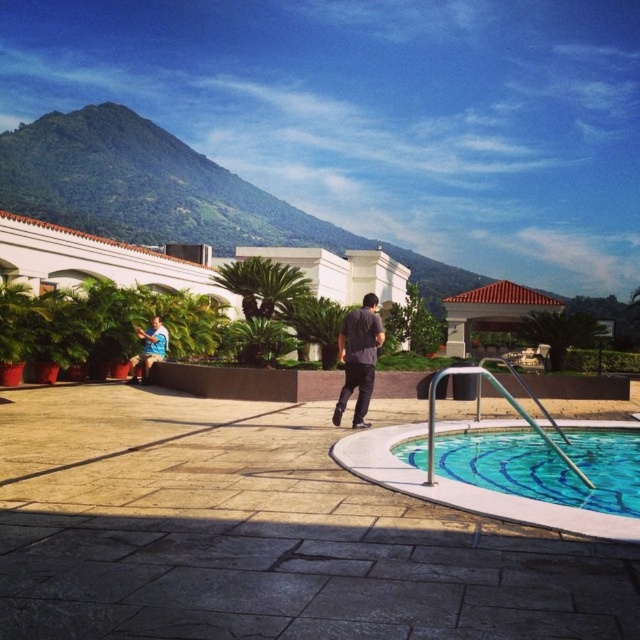
Is the position of dark gray shirt at center more distant than that of blue shirt at lower left?

No, dark gray shirt at center is in front of blue shirt at lower left.

Is dark gray shirt at center to the right of blue shirt at lower left from the viewer's perspective?

Yes, dark gray shirt at center is to the right of blue shirt at lower left.

Find the location of a particular element. Image resolution: width=640 pixels, height=640 pixels. dark gray shirt at center is located at coordinates (358, 358).

Between clear glass pool at lower right and dark gray shirt at center, which one appears on the right side from the viewer's perspective?

clear glass pool at lower right is more to the right.

Looking at this image, can you confirm if clear glass pool at lower right is positioned above dark gray shirt at center?

Incorrect, clear glass pool at lower right is not positioned above dark gray shirt at center.

Is point (532, 492) farther from camera compared to point (360, 392)?

No.

This screenshot has height=640, width=640. I want to click on clear glass pool at lower right, so click(x=547, y=465).

At what (x,y) coordinates should I click in order to perform the action: click on clear glass pool at lower right. Please return your answer as a coordinate pair (x, y). Image resolution: width=640 pixels, height=640 pixels. Looking at the image, I should click on (547, 465).

Does clear glass pool at lower right appear over blue shirt at lower left?

Actually, clear glass pool at lower right is below blue shirt at lower left.

The width and height of the screenshot is (640, 640). In order to click on clear glass pool at lower right in this screenshot , I will do point(547,465).